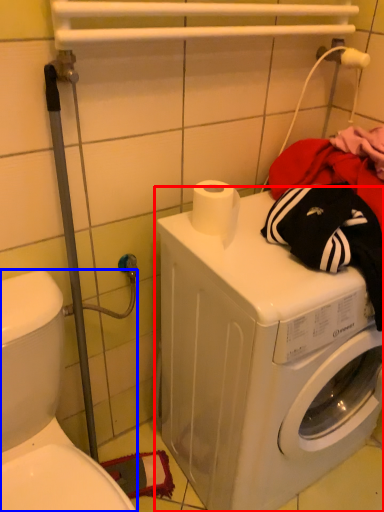
Question: Which object is closer to the camera taking this photo, washing machine (highlighted by a red box) or washer (highlighted by a blue box)?

Choices:
 (A) washing machine
 (B) washer

Answer: (B)